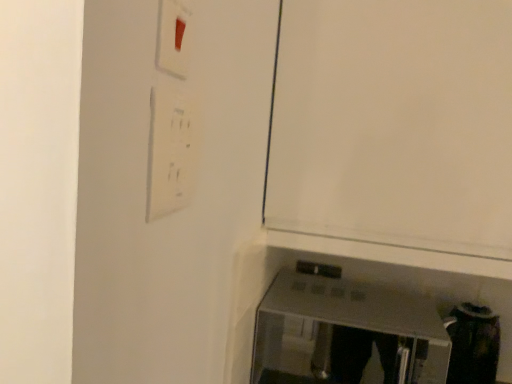
This screenshot has height=384, width=512. Describe the element at coordinates (172, 151) in the screenshot. I see `white plastic light switch at upper left` at that location.

Locate an element on the screen. The width and height of the screenshot is (512, 384). satin silver toaster at lower right is located at coordinates (346, 334).

Is white matte door at center bigger than white plastic light switch at upper left?

Correct, white matte door at center is larger in size than white plastic light switch at upper left.

Is white matte door at center taller than white plastic light switch at upper left?

Yes, white matte door at center is taller than white plastic light switch at upper left.

From a real-world perspective, is white matte door at center positioned above or below white plastic light switch at upper left?

From a real-world perspective, white matte door at center is physically above white plastic light switch at upper left.

Which is closer, (298,4) or (149,156)?

Point (298,4) appears to be farther away from the viewer than point (149,156).

Does satin silver toaster at lower right have a lesser width compared to white plastic light switch at upper left?

No.

From the image's perspective, relative to white plastic light switch at upper left, is satin silver toaster at lower right above or below?

Clearly, from the image's perspective, satin silver toaster at lower right is below white plastic light switch at upper left.

Is satin silver toaster at lower right facing towards white plastic light switch at upper left?

No, satin silver toaster at lower right is not facing towards white plastic light switch at upper left.

In the image, is satin silver toaster at lower right on the left side or the right side of white plastic light switch at upper left?

Clearly, satin silver toaster at lower right is on the right of white plastic light switch at upper left in the image.

Which object is more forward, white plastic light switch at upper left or satin silver toaster at lower right?

white plastic light switch at upper left.

Between white plastic light switch at upper left and satin silver toaster at lower right, which one has more height?

Standing taller between the two is satin silver toaster at lower right.

From the image's perspective, is white plastic light switch at upper left located beneath satin silver toaster at lower right?

No.

Could you tell me if white plastic light switch at upper left is turned towards satin silver toaster at lower right?

No, white plastic light switch at upper left is not facing towards satin silver toaster at lower right.

Is white plastic light switch at upper left next to white matte door at center and touching it?

No.

From the image's perspective, is white plastic light switch at upper left beneath white matte door at center?

Yes, from the image's perspective, white plastic light switch at upper left is beneath white matte door at center.

Where is `door located above the white plastic light switch at upper left (from the image's perspective)`? This screenshot has height=384, width=512. door located above the white plastic light switch at upper left (from the image's perspective) is located at coordinates (394, 123).

Does satin silver toaster at lower right turn towards white matte door at center?

No, satin silver toaster at lower right is not turned towards white matte door at center.

Does satin silver toaster at lower right appear on the left side of white matte door at center?

Indeed, satin silver toaster at lower right is positioned on the left side of white matte door at center.

From the image's perspective, which one is positioned lower, satin silver toaster at lower right or white matte door at center?

satin silver toaster at lower right.

How distant is white matte door at center from satin silver toaster at lower right?

white matte door at center and satin silver toaster at lower right are 1.25 meters apart from each other.

Visually, is white matte door at center positioned to the left or to the right of satin silver toaster at lower right?

white matte door at center is positioned on satin silver toaster at lower right's right side.

From a real-world perspective, who is located higher, white matte door at center or satin silver toaster at lower right?

In real-world perspective, white matte door at center is above.

Locate an element on the screen. door behind the white plastic light switch at upper left is located at coordinates (394, 123).

Identify the location of furniture located below the white plastic light switch at upper left (from the image's perspective). (346, 334).

Estimate the real-world distances between objects in this image. Which object is closer to white matte door at center, white plastic light switch at upper left or satin silver toaster at lower right?

The object closer to white matte door at center is white plastic light switch at upper left.

Based on their spatial positions, is white plastic light switch at upper left or white matte door at center closer to satin silver toaster at lower right?

Based on the image, white matte door at center appears to be nearer to satin silver toaster at lower right.

In the scene shown: Estimate the real-world distances between objects in this image. Which object is closer to white plastic light switch at upper left, satin silver toaster at lower right or white matte door at center?

white matte door at center.

Which object lies nearer to the anchor point white matte door at center, satin silver toaster at lower right or white plastic light switch at upper left?

white plastic light switch at upper left is closer to white matte door at center.

Looking at the image, which one is located closer to satin silver toaster at lower right, white matte door at center or white plastic light switch at upper left?

white matte door at center lies closer to satin silver toaster at lower right than the other object.

Looking at the image, which one is located closer to white plastic light switch at upper left, white matte door at center or satin silver toaster at lower right?

white matte door at center is closer to white plastic light switch at upper left.

This screenshot has width=512, height=384. In order to click on light switch between white matte door at center and satin silver toaster at lower right in the up-down direction in this screenshot , I will do `click(172, 151)`.